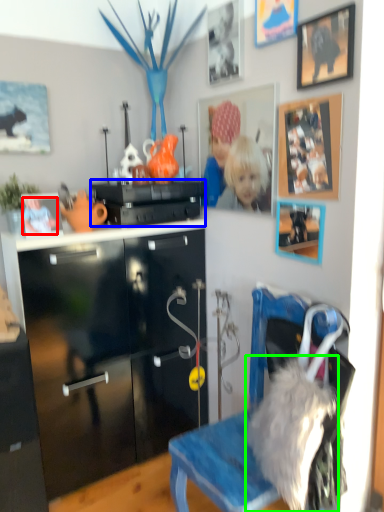
Question: Based on their relative distances, which object is nearer to person (highlighted by a red box)? Choose from appliance (highlighted by a blue box) and fur (highlighted by a green box).

Choices:
 (A) appliance
 (B) fur

Answer: (A)